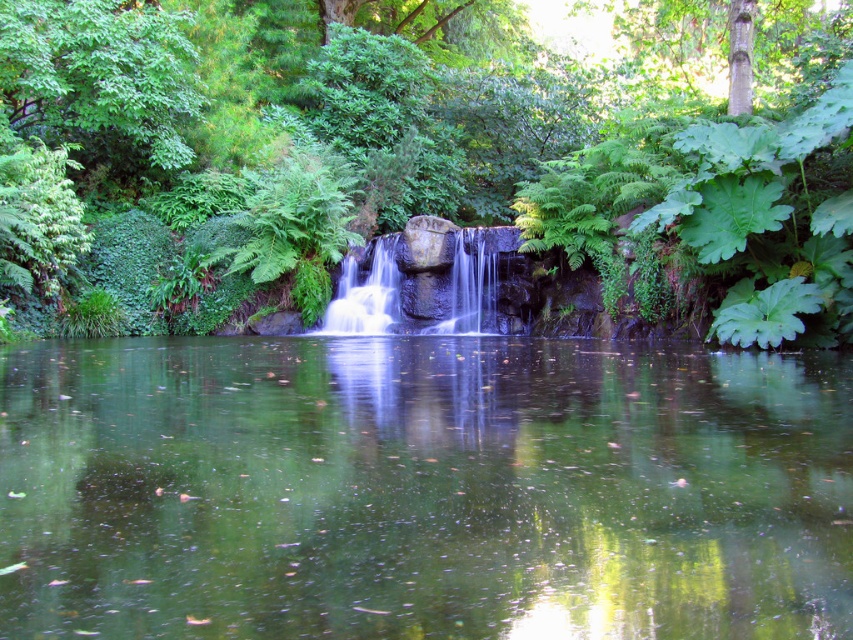
Does green reflective water at center have a smaller size compared to green leafy tree at center?

Correct, green reflective water at center occupies less space than green leafy tree at center.

Who is positioned more to the left, green reflective water at center or green leafy tree at center?

From the viewer's perspective, green leafy tree at center appears more on the left side.

Between point (447, 531) and point (15, 51), which one is positioned in front?

Point (447, 531) is in front.

Where is `green reflective water at center`? green reflective water at center is located at coordinates (422, 488).

Is green leafy tree at center above white smooth waterfall at center?

Yes, green leafy tree at center is above white smooth waterfall at center.

Does green leafy tree at center have a greater height compared to white smooth waterfall at center?

Yes.

Between point (154, 237) and point (479, 241), which one is positioned behind?

The point (154, 237) is more distant.

I want to click on green leafy tree at center, so tap(714, 211).

Does green reflective water at center come behind white smooth waterfall at center?

No, green reflective water at center is closer to the viewer.

What do you see at coordinates (422, 488) in the screenshot? I see `green reflective water at center` at bounding box center [422, 488].

Is point (780, 540) farther from viewer compared to point (412, 282)?

No.

The width and height of the screenshot is (853, 640). What are the coordinates of `green reflective water at center` in the screenshot? It's located at (422, 488).